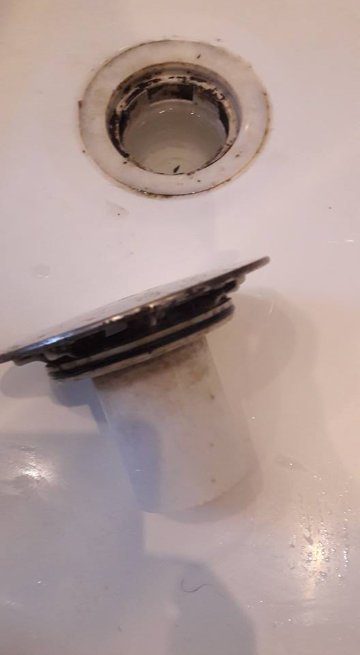
Find the location of a particular element. The height and width of the screenshot is (655, 360). white interior of sink is located at coordinates (298, 164).